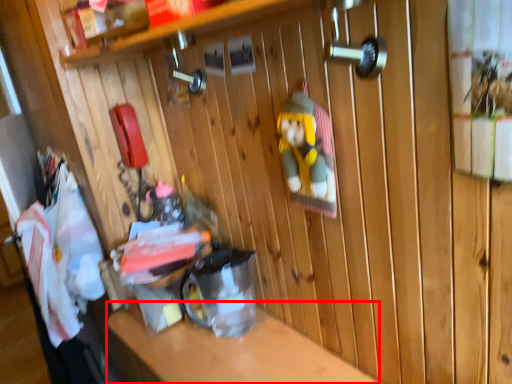
Question: From the image's perspective, what is the correct spatial positioning of counter top (annotated by the red box) in reference to laundry?

Choices:
 (A) below
 (B) above

Answer: (A)